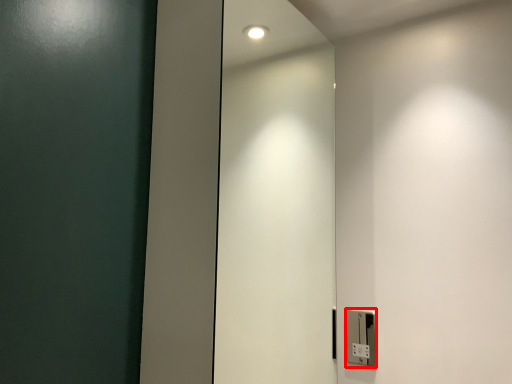
Question: From the image's perspective, what is the correct spatial positioning of light switch (annotated by the red box) in reference to elevator door?

Choices:
 (A) below
 (B) above

Answer: (A)